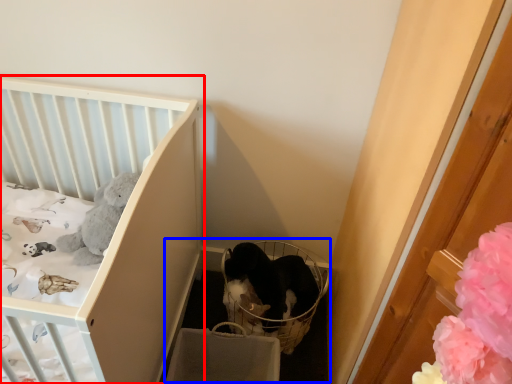
Question: Which point is closer to the camera, infant bed (highlighted by a red box) or baby carriage (highlighted by a blue box)?

Choices:
 (A) infant bed
 (B) baby carriage

Answer: (A)